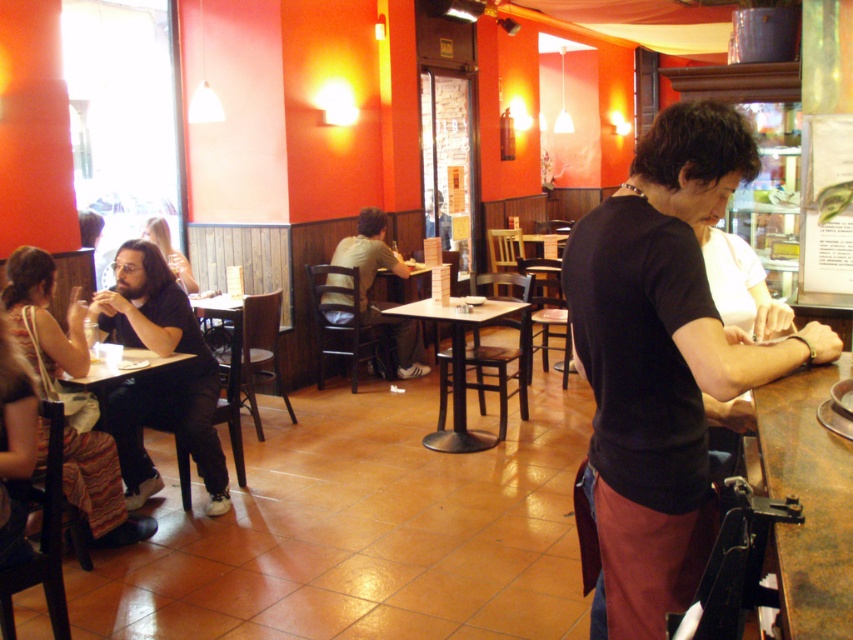
Question: Which point is farther to the camera?

Choices:
 (A) (820, 531)
 (B) (409, 346)
 (C) (492, 438)

Answer: (B)

Question: Is black matte shirt at bar to the left of wooden table at center from the viewer's perspective?

Choices:
 (A) no
 (B) yes

Answer: (A)

Question: Which is farther from the rustic wood table at bar?

Choices:
 (A) matte black hair at upper left
 (B) light brown wood chair at center

Answer: (A)

Question: Does wooden table at center have a greater width compared to matte black hair at upper left?

Choices:
 (A) no
 (B) yes

Answer: (B)

Question: Considering the real-world distances, which object is farthest from the light brown wood chair at center?

Choices:
 (A) rustic wood table at bar
 (B) brown woven bag at left
 (C) wooden table at lower left

Answer: (A)

Question: Is matte black shirt at left smaller than brown woven bag at left?

Choices:
 (A) no
 (B) yes

Answer: (B)